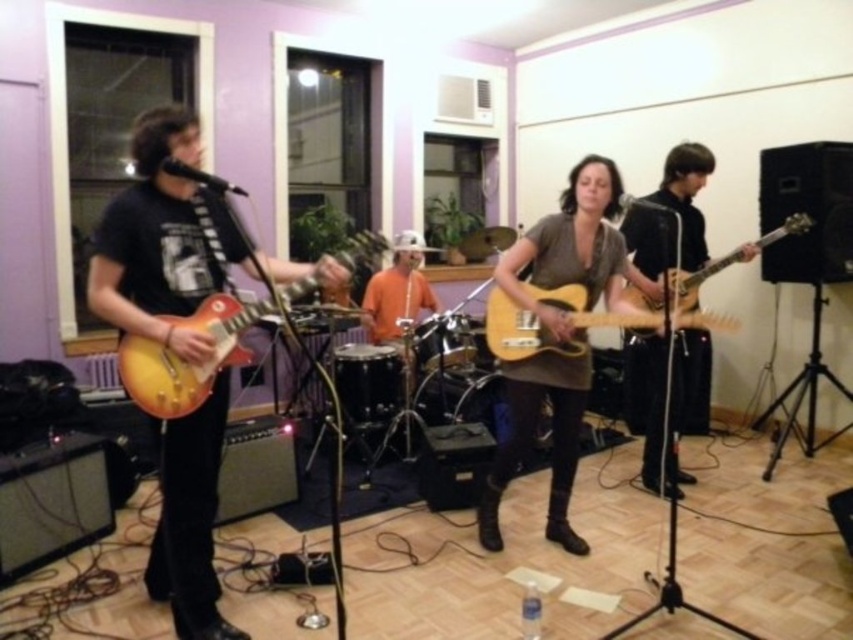
In the scene shown: You are a photographer setting up for a live music shoot. You need to position a spotlight so that it illuminates both the sunburst wood electric guitar at left and the light wood electric guitar at center without casting shadows on the purple walls. Based on their positions, where should you place the spotlight relative to these guitars?

The sunburst wood electric guitar at left is located below the light wood electric guitar at center. To avoid casting shadows on the purple walls, the spotlight should be placed above and between both guitars, shining downward so that the light covers both instruments while keeping the walls shadow free.

You are a stagehand who needs to move the light wood electric guitar at center closer to the matte brown guitar at right. How much space do you need to move it to ensure they are touching?

The distance between the matte brown guitar at right and the light wood electric guitar at center is 18.73 inches. To make them touch, you need to move the light wood electric guitar at center by 18.73 inches towards the matte brown guitar at right.